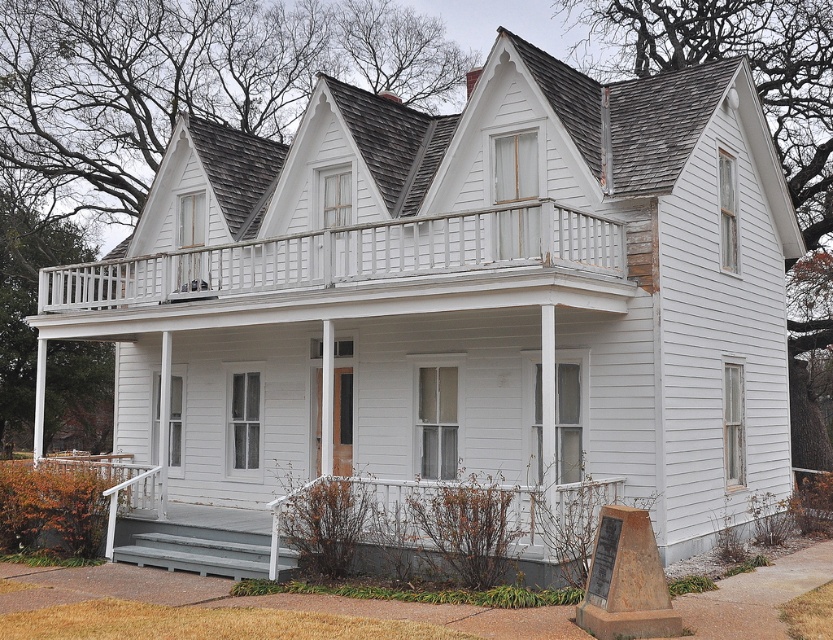
Is white wooden porch at upper center wider than brown stone marker at lower right?

Yes.

Who is higher up, white wooden porch at upper center or brown stone marker at lower right?

white wooden porch at upper center is above.

The width and height of the screenshot is (833, 640). I want to click on white wooden porch at upper center, so click(x=345, y=257).

You are a GUI agent. You are given a task and a screenshot of the screen. Output one action in this format:
    pyautogui.click(x=<x>, y=<y>)
    Task: Click on the white wooden porch at upper center
    
    Given the screenshot: What is the action you would take?
    (x=345, y=257)